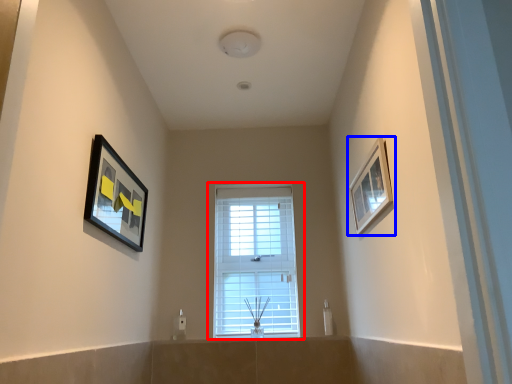
Question: Which point is closer to the camera, window (highlighted by a red box) or picture frame (highlighted by a blue box)?

Choices:
 (A) window
 (B) picture frame

Answer: (B)